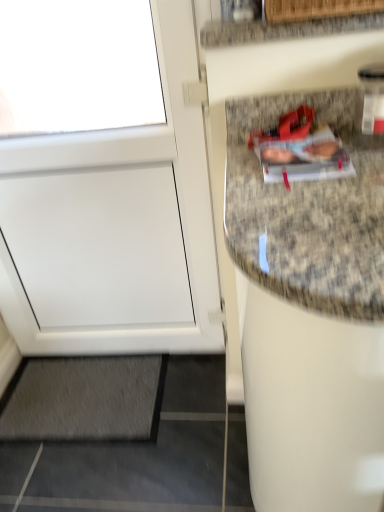
Question: Are gray carpet at lower left and white matte door at left making contact?

Choices:
 (A) no
 (B) yes

Answer: (A)

Question: Is gray carpet at lower left positioned behind white matte door at left?

Choices:
 (A) yes
 (B) no

Answer: (A)

Question: Considering the relative positions of gray carpet at lower left and white matte door at left in the image provided, is gray carpet at lower left to the left of white matte door at left from the viewer's perspective?

Choices:
 (A) no
 (B) yes

Answer: (B)

Question: Is gray carpet at lower left oriented towards white matte door at left?

Choices:
 (A) yes
 (B) no

Answer: (B)

Question: From the image's perspective, is gray carpet at lower left over white matte door at left?

Choices:
 (A) yes
 (B) no

Answer: (B)

Question: Is granite countertop at upper right inside or outside of gray carpet at lower left?

Choices:
 (A) inside
 (B) outside

Answer: (B)

Question: From the image's perspective, is granite countertop at upper right positioned above or below gray carpet at lower left?

Choices:
 (A) below
 (B) above

Answer: (B)

Question: Considering the positions of granite countertop at upper right and gray carpet at lower left in the image, is granite countertop at upper right wider or thinner than gray carpet at lower left?

Choices:
 (A) wide
 (B) thin

Answer: (B)

Question: Considering the relative positions of granite countertop at upper right and gray carpet at lower left in the image provided, is granite countertop at upper right to the left or to the right of gray carpet at lower left?

Choices:
 (A) right
 (B) left

Answer: (A)

Question: Considering the positions of point (359, 27) and point (210, 224), is point (359, 27) closer or farther from the camera than point (210, 224)?

Choices:
 (A) farther
 (B) closer

Answer: (B)

Question: Choose the correct answer: Is granite countertop at upper right inside white matte door at left or outside it?

Choices:
 (A) inside
 (B) outside

Answer: (B)

Question: From the image's perspective, is granite countertop at upper right located above or below white matte door at left?

Choices:
 (A) below
 (B) above

Answer: (B)

Question: From a real-world perspective, relative to white matte door at left, is granite countertop at upper right vertically above or below?

Choices:
 (A) above
 (B) below

Answer: (A)

Question: Is gray carpet at lower left inside or outside of white matte door at left?

Choices:
 (A) outside
 (B) inside

Answer: (A)

Question: Based on their sizes in the image, would you say gray carpet at lower left is bigger or smaller than white matte door at left?

Choices:
 (A) small
 (B) big

Answer: (A)